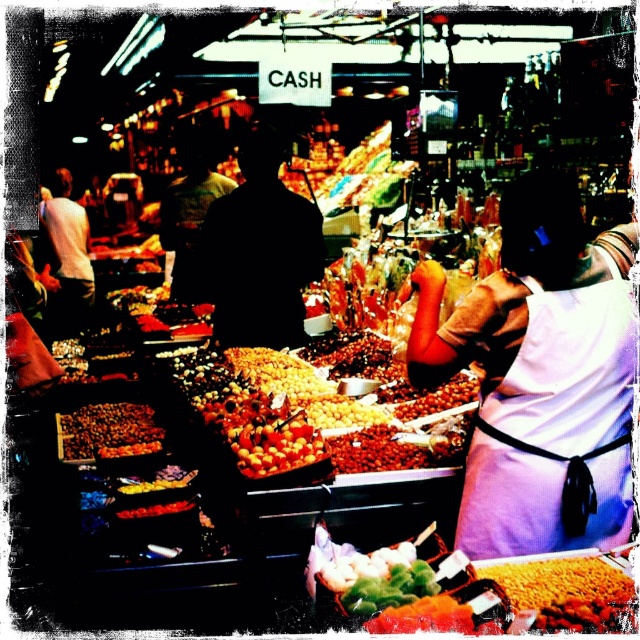
You are a customer at the market stall and want to grab both items located at point (134, 435) and point (296, 444). Which item is closer to you?

Point (134, 435) is behind point (296, 444), so the item at point (296, 444) is closer to you.